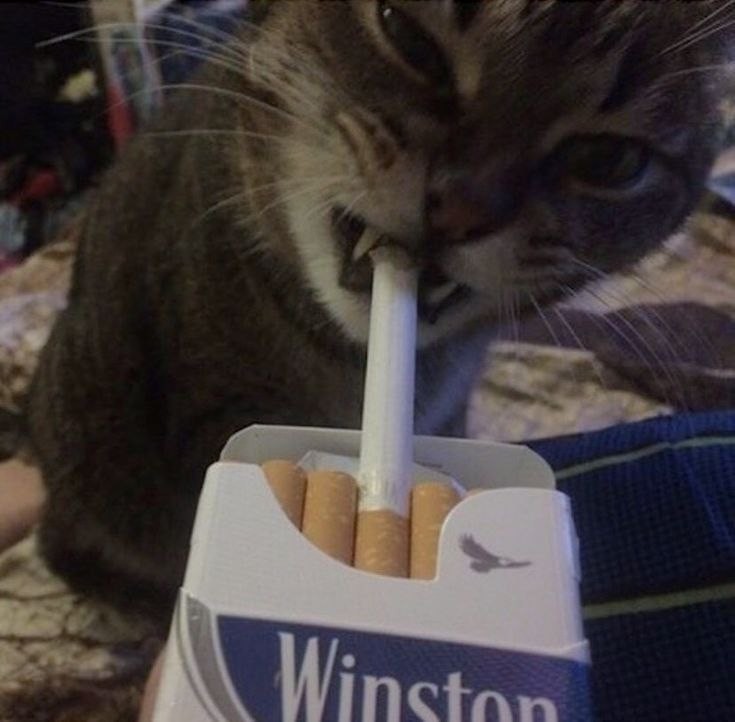
This screenshot has width=735, height=722. I want to click on bed, so click(711, 304), click(531, 401), click(28, 671).